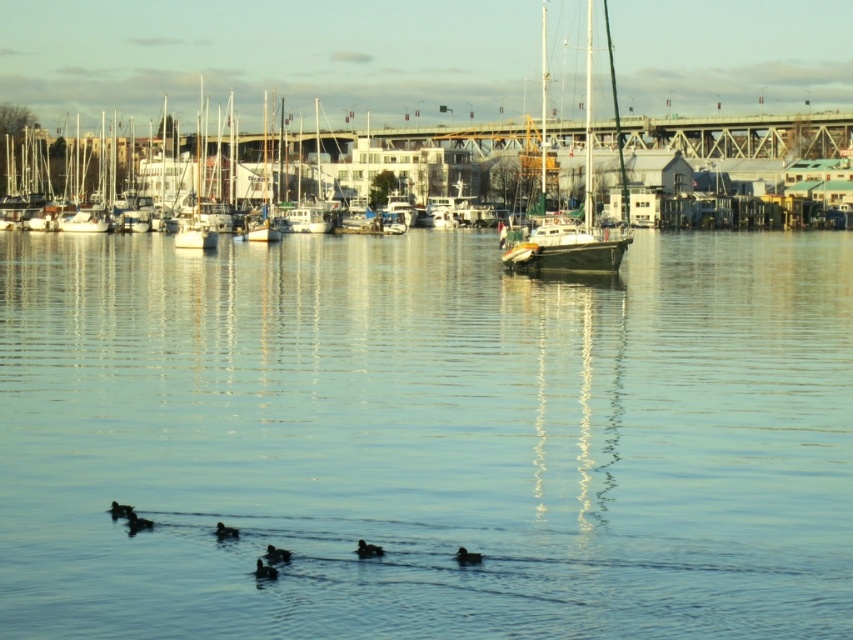
You are a photographer standing at the waterfront. You want to capture a photo that includes both the white wooden sailboat at center and the brown fuzzy duck at lower center. Which object will appear larger in the photo?

The white wooden sailboat at center will appear larger in the photo because it is taller than the brown fuzzy duck at lower center.